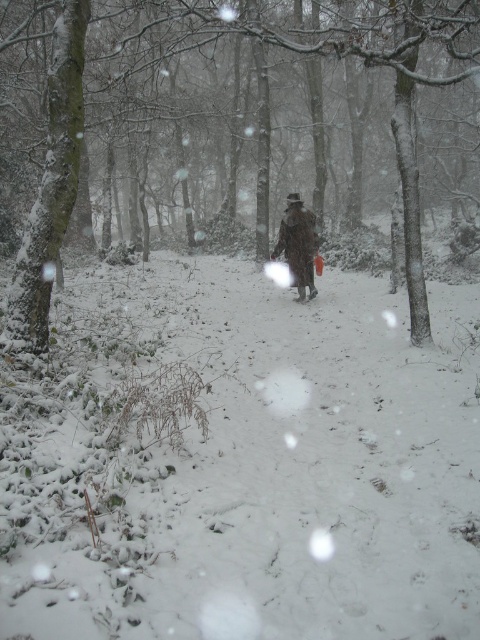
Question: Can you confirm if white fluffy snow at center is positioned to the left of snow-covered bark tree at left?

Choices:
 (A) yes
 (B) no

Answer: (A)

Question: Which object appears farthest from the camera in this image?

Choices:
 (A) white fluffy snow at center
 (B) snow-covered bark tree at left

Answer: (B)

Question: Does white fluffy snow at center come in front of snow-covered bark tree at left?

Choices:
 (A) yes
 (B) no

Answer: (A)

Question: Which point is farther to the camera?

Choices:
 (A) snow-covered bark tree at left
 (B) brown wool coat at center

Answer: (B)

Question: Which point is farther from the camera taking this photo?

Choices:
 (A) (315, 36)
 (B) (168, 481)

Answer: (A)

Question: From the image, what is the correct spatial relationship of white fluffy snow at center in relation to snow-covered bark tree at left?

Choices:
 (A) below
 (B) above

Answer: (A)